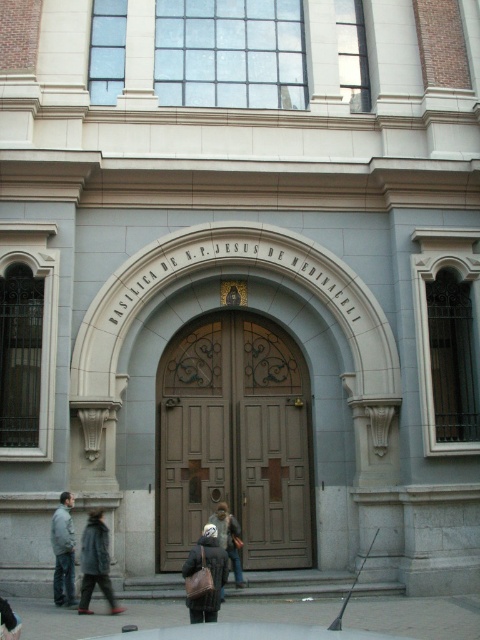
Is point (224, 563) positioned before point (90, 584)?

That is True.

Is dark brown leather coat at center below dark gray wool coat at lower left?

No.

Is point (205, 564) farther from viewer compared to point (107, 586)?

That is False.

This screenshot has height=640, width=480. What are the coordinates of `dark brown leather coat at center` in the screenshot? It's located at (211, 573).

Who is more distant from viewer, (218, 550) or (68, 518)?

Point (68, 518)

Is dark brown leather coat at center below gray fabric jacket at lower left?

Yes, dark brown leather coat at center is below gray fabric jacket at lower left.

Is point (216, 547) behind point (67, 547)?

No, (216, 547) is closer to viewer.

Find the location of a particular element. The image size is (480, 640). dark brown leather coat at center is located at coordinates (211, 573).

Can you confirm if dark gray wool coat at lower left is positioned to the right of gray fabric jacket at lower left?

Yes, dark gray wool coat at lower left is to the right of gray fabric jacket at lower left.

Can you confirm if dark gray wool coat at lower left is wider than gray fabric jacket at lower left?

Yes.

Does point (91, 611) lie behind point (60, 570)?

No, (91, 611) is in front of (60, 570).

The image size is (480, 640). Find the location of `dark gray wool coat at lower left`. dark gray wool coat at lower left is located at coordinates (96, 563).